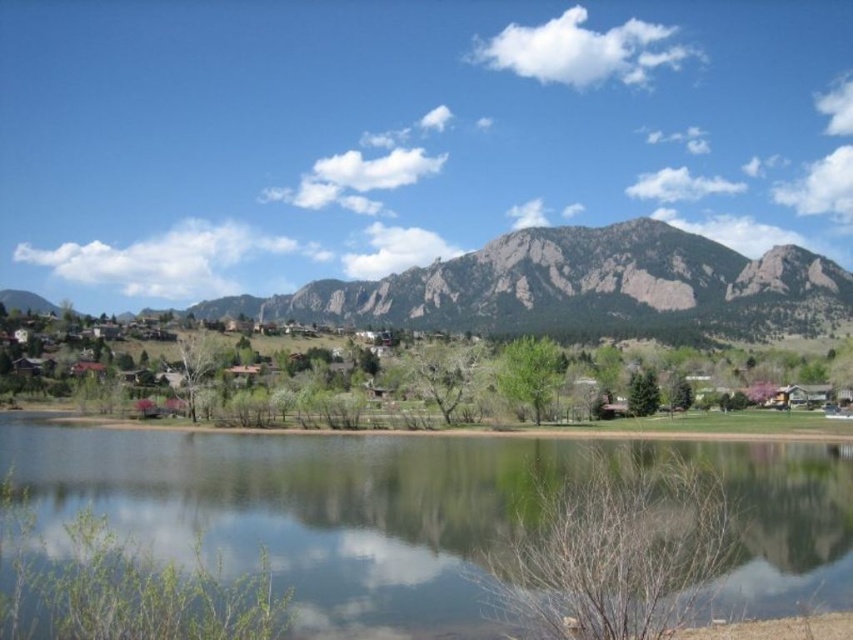
Who is positioned more to the right, clear water at center or green grassy mountain at center?

clear water at center is more to the right.

Which is behind, point (552, 440) or point (685, 275)?

Point (685, 275)

Which is behind, point (456, 618) or point (701, 328)?

Positioned behind is point (701, 328).

You are a GUI agent. You are given a task and a screenshot of the screen. Output one action in this format:
    pyautogui.click(x=<x>, y=<y>)
    Task: Click on the clear water at center
    Image resolution: width=853 pixels, height=640 pixels.
    Given the screenshot: What is the action you would take?
    pyautogui.click(x=305, y=512)